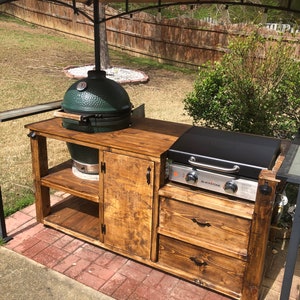
This screenshot has height=300, width=300. In order to click on plant in this screenshot , I will do `click(267, 101)`.